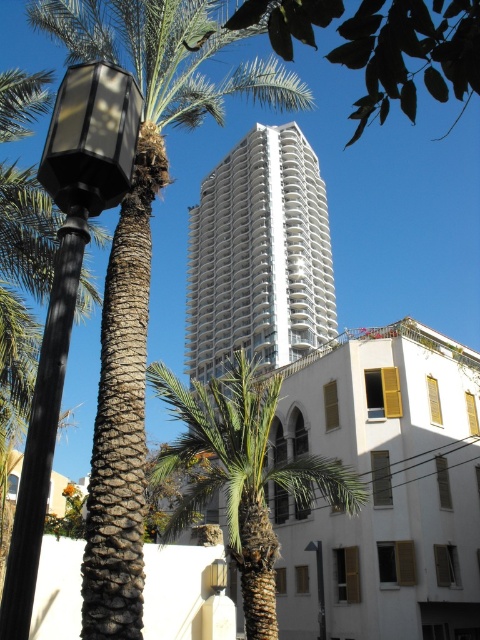
You are a city planner assessing the urban space. You need to determine if the green leafy tree at upper center and the black polished pole at left will fit within a designated 10m x 10m plot. Given their sizes, can both fit side by side?

The green leafy tree at upper center is bigger than the black polished pole at left, but without specific dimensions, it is unclear if both can fit within the 10m x 10m plot. More information about their exact sizes is needed.

You are standing in the urban scene looking at two points marked on the image. The first point is at coordinates point (368, 120) and the second is at point (78, 253). Which point is closer to you?

Point (368, 120) is further to the viewer than point (78, 253), so the second point is closer to you.

You are a city planner evaluating the space between the green textured palm tree at center and the metallic gray streetlamp at center. Based on their widths, which object would require more horizontal space in the sidewalk area?

The green textured palm tree at center has a greater width than the metallic gray streetlamp at center, so it would require more horizontal space in the sidewalk area.